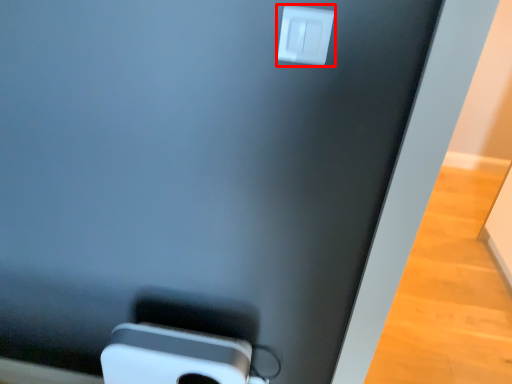
Question: Where is power plugs and sockets (annotated by the red box) located in relation to ipod in the image?

Choices:
 (A) left
 (B) right

Answer: (B)